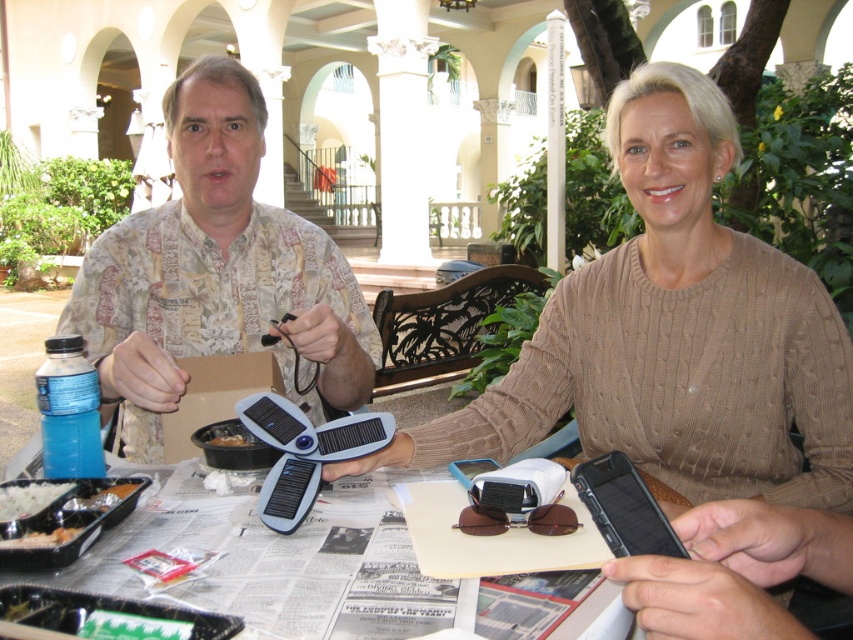
Is knitted beige sweater at center smaller than black plastic tray at lower left?

No.

Who is higher up, knitted beige sweater at center or black plastic tray at lower left?

knitted beige sweater at center is above.

Describe the element at coordinates (674, 333) in the screenshot. I see `knitted beige sweater at center` at that location.

This screenshot has width=853, height=640. I want to click on knitted beige sweater at center, so click(x=674, y=333).

Who is more forward, (32, 492) or (22, 508)?

Point (22, 508) is more forward.

Is black plastic tray at lower left smaller than white matte rice at lower left?

Incorrect, black plastic tray at lower left is not smaller in size than white matte rice at lower left.

At what (x,y) coordinates should I click in order to perform the action: click on black plastic tray at lower left. Please return your answer as a coordinate pair (x, y). Looking at the image, I should click on (53, 504).

Who is positioned more to the right, knitted beige sweater at center or brown paper bag at center?

From the viewer's perspective, knitted beige sweater at center appears more on the right side.

Can you confirm if knitted beige sweater at center is shorter than brown paper bag at center?

No, knitted beige sweater at center is not shorter than brown paper bag at center.

Describe the element at coordinates (674, 333) in the screenshot. I see `knitted beige sweater at center` at that location.

Where is `knitted beige sweater at center`? Image resolution: width=853 pixels, height=640 pixels. knitted beige sweater at center is located at coordinates (674, 333).